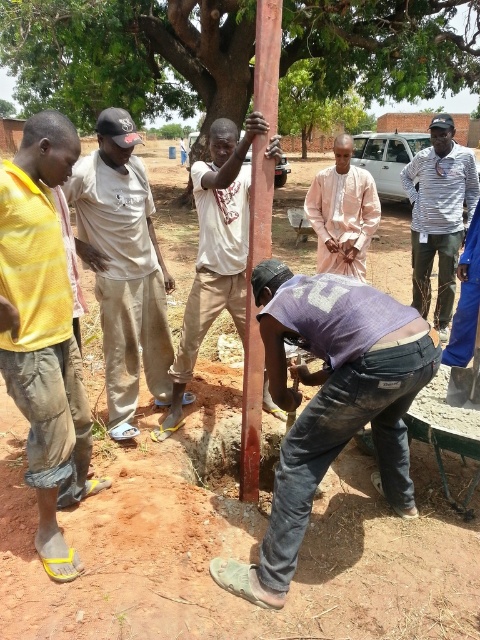
Consider the image. Is the position of worn denim jeans at lower center more distant than that of yellow mesh shirt at left?

No, it is in front of yellow mesh shirt at left.

Can you confirm if worn denim jeans at lower center is positioned below yellow mesh shirt at left?

Indeed, worn denim jeans at lower center is positioned under yellow mesh shirt at left.

Is point (342, 333) farther from camera compared to point (54, 577)?

No, (342, 333) is in front of (54, 577).

This screenshot has width=480, height=640. In order to click on worn denim jeans at lower center in this screenshot , I will do `click(331, 403)`.

Who is shorter, smooth wood pole at center or light pink fabric at center?

light pink fabric at center

Is smooth wood pole at center shorter than light pink fabric at center?

No.

Between point (364, 19) and point (355, 204), which one is positioned in front?

Point (355, 204)

Where is `smooth wood pole at center`? smooth wood pole at center is located at coordinates (130, 54).

Which of these two, smooth wood pole at center or worn denim jeans at lower center, stands shorter?

worn denim jeans at lower center

Is smooth wood pole at center positioned at the back of worn denim jeans at lower center?

Yes, smooth wood pole at center is behind worn denim jeans at lower center.

Measure the distance between point (446, 51) and camera.

Point (446, 51) and camera are 13.86 meters apart from each other.

At what (x,y) coordinates should I click in order to perform the action: click on smooth wood pole at center. Please return your answer as a coordinate pair (x, y). Looking at the image, I should click on (130, 54).